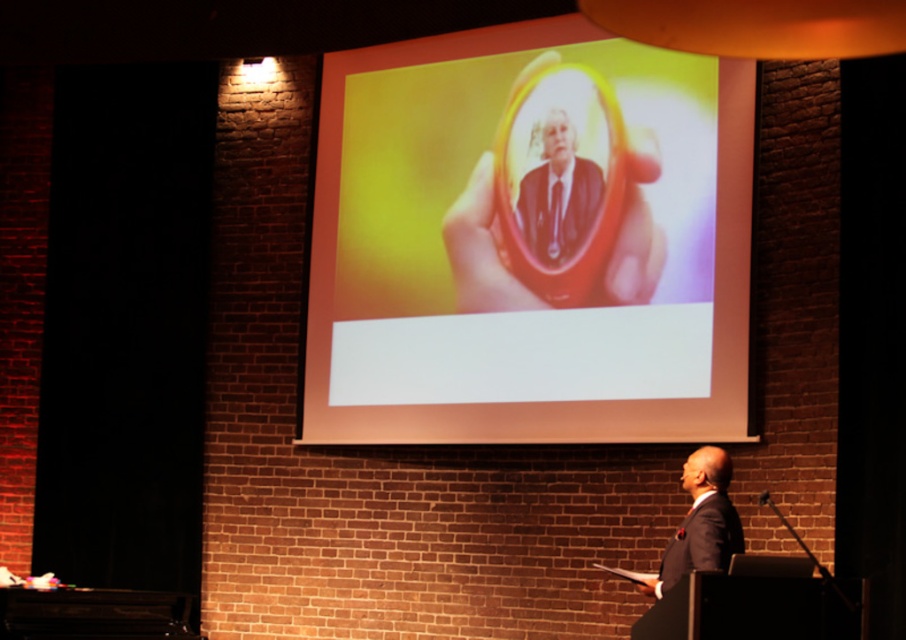
Which is below, matte plastic mirror at center or matte black suit at center?

Positioned lower is matte plastic mirror at center.

Who is more forward, (589, 346) or (532, 228)?

Point (589, 346)

Identify the location of matte plastic mirror at center. The image size is (906, 640). (527, 248).

Does matte black suit at center appear over dark suit at center?

Yes.

Does matte black suit at center have a greater width compared to dark suit at center?

Indeed, matte black suit at center has a greater width compared to dark suit at center.

Image resolution: width=906 pixels, height=640 pixels. What are the coordinates of `matte black suit at center` in the screenshot? It's located at (558, 193).

Who is positioned more to the left, matte plastic mirror at center or dark suit at center?

matte plastic mirror at center is more to the left.

Which of these two, matte plastic mirror at center or dark suit at center, stands shorter?

dark suit at center

The image size is (906, 640). In order to click on matte plastic mirror at center in this screenshot , I will do `click(527, 248)`.